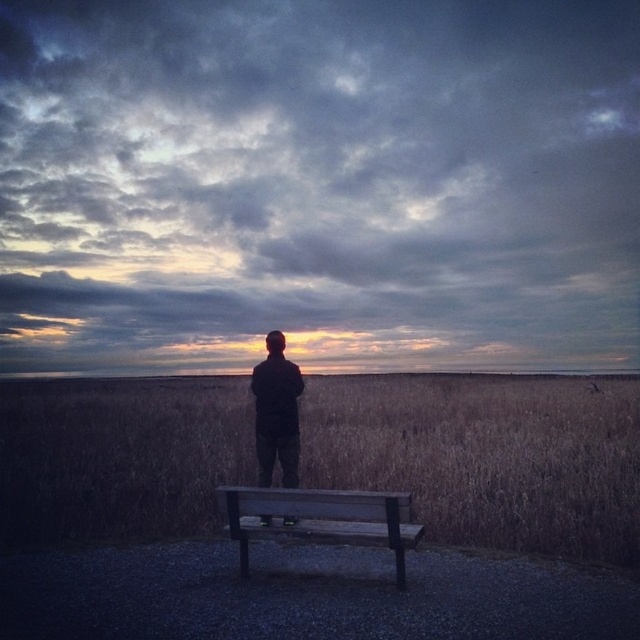
Based on the photo, how distant is brown grassy field at center from black matte jacket at center?

They are 25.01 feet apart.

Does brown grassy field at center have a lesser width compared to black matte jacket at center?

No.

Which is in front, point (92, 426) or point (266, 396)?

Point (266, 396) is more forward.

Find the location of a particular element. The image size is (640, 640). brown grassy field at center is located at coordinates (486, 456).

Which is in front, point (230, 509) or point (260, 397)?

Point (230, 509) is more forward.

Is wooden bench at lower center to the left of black matte jacket at center from the viewer's perspective?

In fact, wooden bench at lower center is to the right of black matte jacket at center.

Describe the element at coordinates (321, 518) in the screenshot. This screenshot has height=640, width=640. I see `wooden bench at lower center` at that location.

This screenshot has height=640, width=640. I want to click on wooden bench at lower center, so click(x=321, y=518).

Does point (589, 541) come behind point (269, 506)?

Yes.

Can you confirm if brown grassy field at center is positioned to the right of wooden bench at lower center?

Indeed, brown grassy field at center is positioned on the right side of wooden bench at lower center.

This screenshot has width=640, height=640. What do you see at coordinates (486, 456) in the screenshot?
I see `brown grassy field at center` at bounding box center [486, 456].

You are a GUI agent. You are given a task and a screenshot of the screen. Output one action in this format:
    pyautogui.click(x=<x>, y=<y>)
    Task: Click on the brown grassy field at center
    
    Given the screenshot: What is the action you would take?
    pyautogui.click(x=486, y=456)